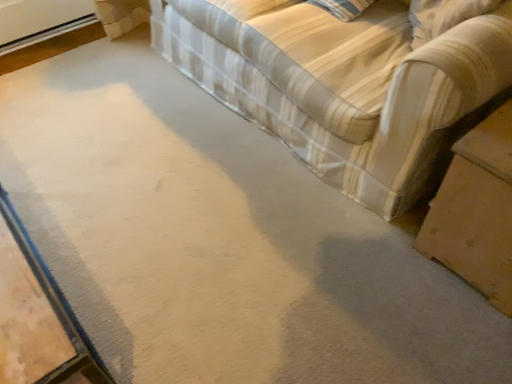
Question: Does striped fabric couch at upper right come in front of wooden table at lower right?

Choices:
 (A) yes
 (B) no

Answer: (A)

Question: Could wooden table at lower right be considered to be inside striped fabric couch at upper right?

Choices:
 (A) no
 (B) yes

Answer: (A)

Question: Is striped fabric couch at upper right positioned behind wooden table at lower right?

Choices:
 (A) no
 (B) yes

Answer: (A)

Question: Is striped fabric couch at upper right at the right side of wooden table at lower right?

Choices:
 (A) yes
 (B) no

Answer: (B)

Question: From the image's perspective, is striped fabric couch at upper right on wooden table at lower right?

Choices:
 (A) no
 (B) yes

Answer: (B)

Question: Can you confirm if striped fabric couch at upper right is shorter than wooden table at lower right?

Choices:
 (A) no
 (B) yes

Answer: (A)

Question: Is striped fabric couch at upper right at the back of wooden table at lower right?

Choices:
 (A) yes
 (B) no

Answer: (A)

Question: Is wooden table at lower right shorter than striped fabric couch at upper right?

Choices:
 (A) no
 (B) yes

Answer: (B)

Question: Is striped fabric couch at upper right surrounded by wooden table at lower right?

Choices:
 (A) yes
 (B) no

Answer: (B)

Question: From the image's perspective, does wooden table at lower right appear lower than striped fabric couch at upper right?

Choices:
 (A) no
 (B) yes

Answer: (B)

Question: Is wooden table at lower right completely or partially outside of striped fabric couch at upper right?

Choices:
 (A) yes
 (B) no

Answer: (A)

Question: Is the position of wooden table at lower right more distant than that of striped fabric couch at upper right?

Choices:
 (A) no
 (B) yes

Answer: (B)

Question: Is point (302, 8) positioned closer to the camera than point (422, 243)?

Choices:
 (A) closer
 (B) farther

Answer: (B)